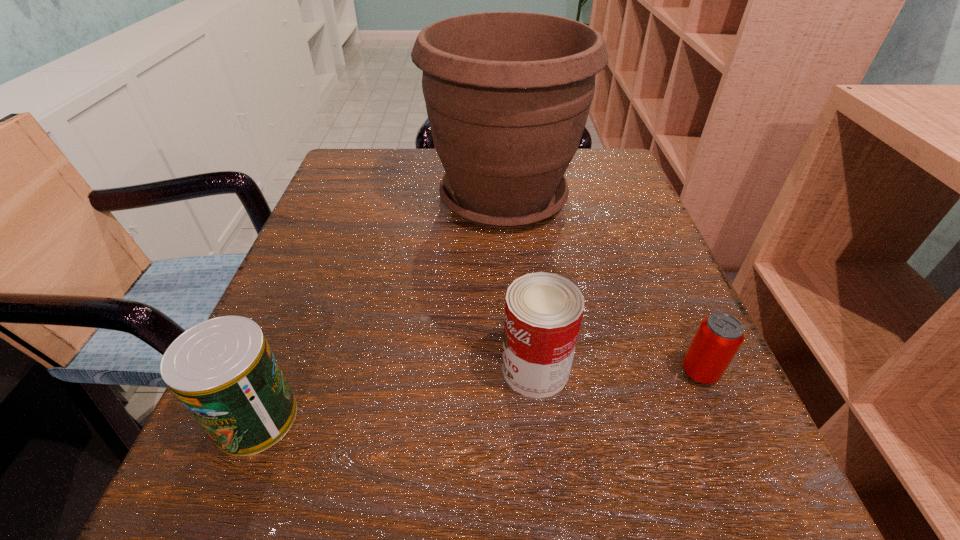
Identify which object is located as the nearest to the rightmost can. Please provide its 2D coordinates. Your answer should be formatted as a tuple, i.e. [(x, y)], where the tuple contains the x and y coordinates of a point satisfying the conditions above.

[(543, 311)]

This screenshot has height=540, width=960. I want to click on object that is the closest to the leftmost can, so click(543, 311).

Find the location of `the second closest can to the leftmost object`. the second closest can to the leftmost object is located at coordinates (719, 336).

Identify which can is located as the nearest to the leftmost object. Please provide its 2D coordinates. Your answer should be formatted as a tuple, i.e. [(x, y)], where the tuple contains the x and y coordinates of a point satisfying the conditions above.

[(543, 311)]

You are a GUI agent. You are given a task and a screenshot of the screen. Output one action in this format:
    pyautogui.click(x=<x>, y=<y>)
    Task: Click on the free space that satisfies the following two spatial constraints: 1. on the back side of the leftmost can; 2. on the right side of the tallest object
    The height and width of the screenshot is (540, 960).
    Given the screenshot: What is the action you would take?
    pyautogui.click(x=345, y=198)

The height and width of the screenshot is (540, 960). I want to click on free space that satisfies the following two spatial constraints: 1. on the front label of the rightmost object; 2. on the left side of the second can from left to right, so click(536, 372).